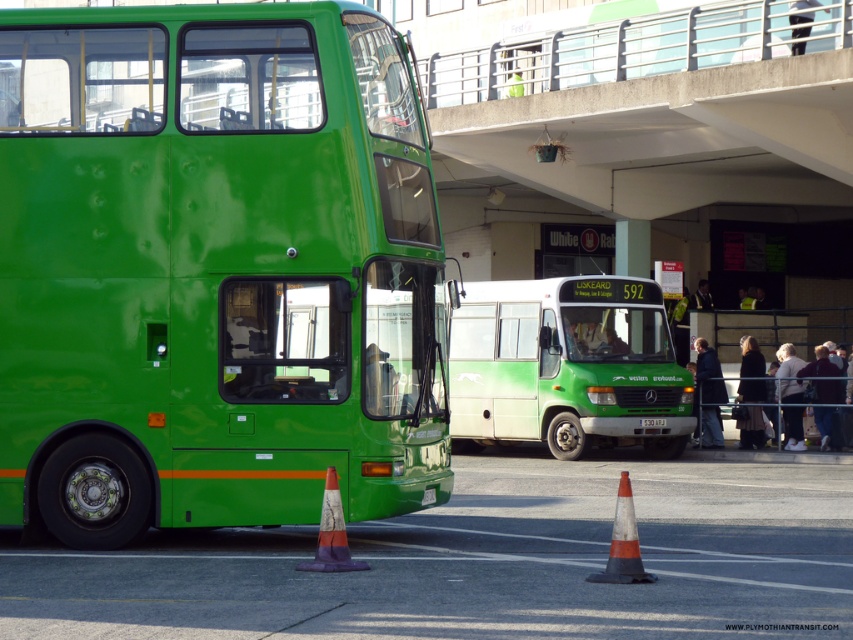
You are a passenger waiting at the bus stop and see the green matte bus at left and the green plastic license plate at center. Which object is positioned higher in the image?

The green matte bus at left is located above the green plastic license plate at center, so it is positioned higher in the image.

You are standing at the bus station and want to take a photo of the bright green double decker bus. You notice two points marked on the ground at coordinates point (219,352) and point (650,428). Which point is better to stand on to get the bus in focus if you want to ensure the closest point to the camera is sharp?

Point (219,352) is closer to the camera than point (650,428), so standing on point (219,352) will ensure the closest point to the camera is sharp and in focus.

You are a pedestrian standing at the bus station and see the orange and white striped cone at lower center and the orange and white striped traffic cone at lower center. Which one is higher up in the image?

The orange and white striped cone at lower center is located above the orange and white striped traffic cone at lower center, so it is higher up in the image.